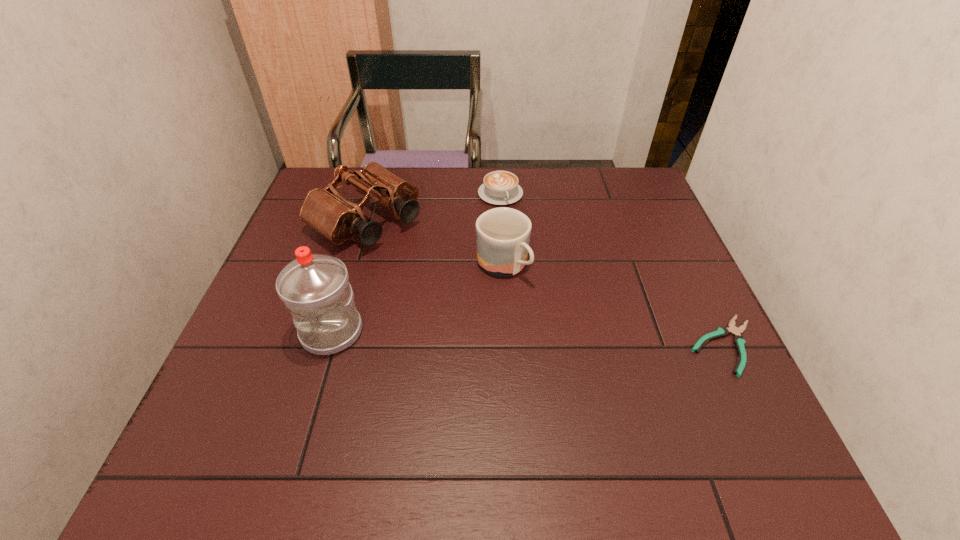
I want to click on free location that satisfies the following two spatial constraints: 1. on the front side of the binoculars; 2. on the left side of the rightmost object, so click(329, 346).

Locate an element on the screen. free space that satisfies the following two spatial constraints: 1. on the handle side of the tallest object; 2. on the right side of the shortest object is located at coordinates (327, 346).